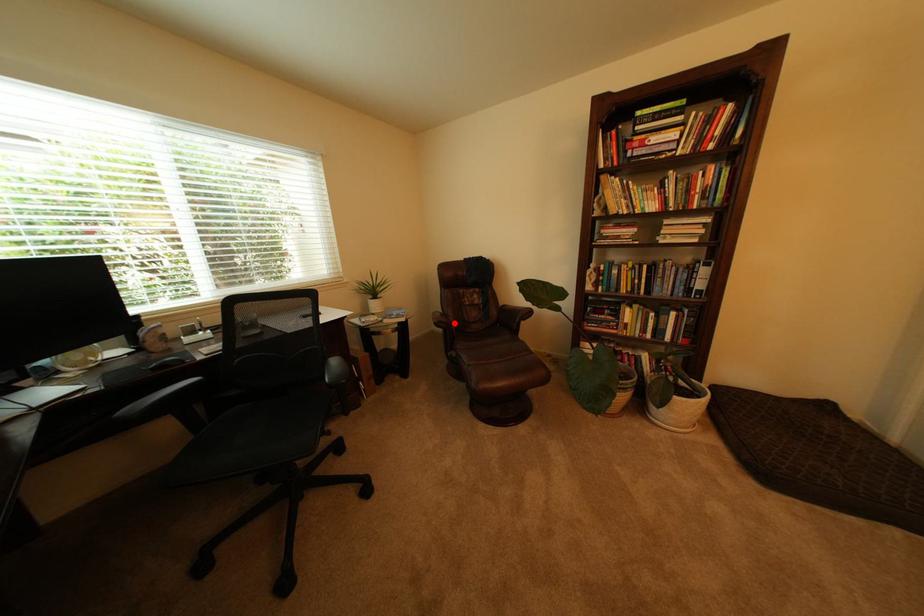
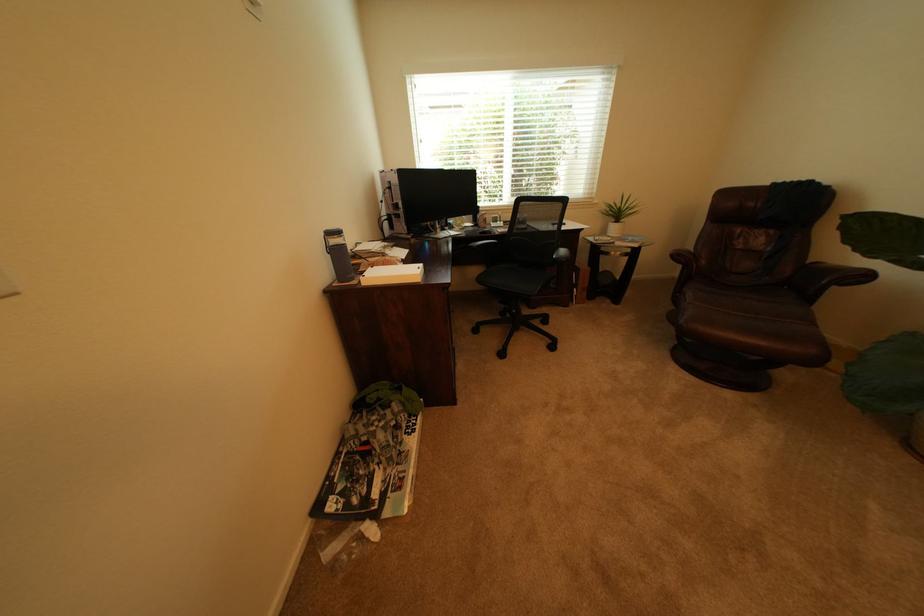
In the second image, find the point that corresponds to the highlighted location in the first image.

(695, 257)